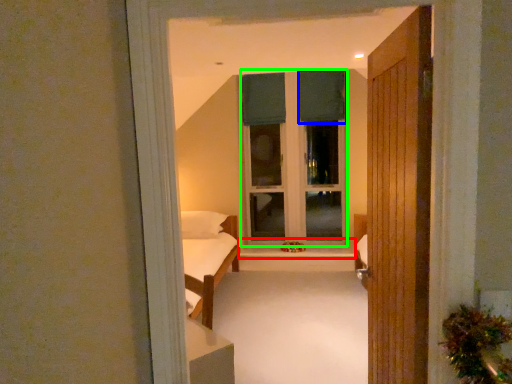
Question: Which object is the closest to the window sill (highlighted by a red box)? Choose among these: curtain (highlighted by a blue box) or window frame (highlighted by a green box).

Choices:
 (A) curtain
 (B) window frame

Answer: (B)